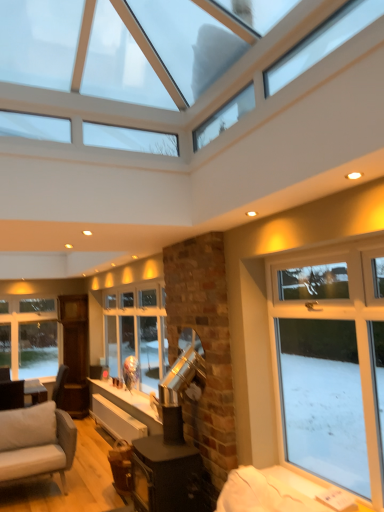
Question: In the image, is clear glass window at upper center, the 2th window from the back, positioned in front of or behind white glass window at lower left, the 1th window positioned from the bottom?

Choices:
 (A) behind
 (B) front

Answer: (B)

Question: Is clear glass window at upper center, which appears as the 1th window when viewed from the front, taller or shorter than white glass window at lower left, the second window viewed from the front?

Choices:
 (A) short
 (B) tall

Answer: (A)

Question: Is clear glass window at upper center, which is the second window from bottom to top, spatially inside white glass window at lower left, the second window viewed from the front, or outside of it?

Choices:
 (A) inside
 (B) outside

Answer: (B)

Question: In terms of height, does white glass window at lower left, the 1th window positioned from the bottom, look taller or shorter compared to clear glass window at upper center, which appears as the 1th window when viewed from the front?

Choices:
 (A) short
 (B) tall

Answer: (B)

Question: From the image's perspective, is white glass window at lower left, which is the second window in top-to-bottom order, positioned above or below clear glass window at upper center, which appears as the 1th window when viewed from the front?

Choices:
 (A) above
 (B) below

Answer: (B)

Question: Considering the positions of point (49, 354) and point (196, 124), is point (49, 354) closer or farther from the camera than point (196, 124)?

Choices:
 (A) closer
 (B) farther

Answer: (B)

Question: Considering the positions of white glass window at lower left, the 1th window viewed from the back, and clear glass window at upper center, which is the second window from bottom to top, in the image, is white glass window at lower left, the 1th window viewed from the back, bigger or smaller than clear glass window at upper center, which is the second window from bottom to top,?

Choices:
 (A) small
 (B) big

Answer: (A)